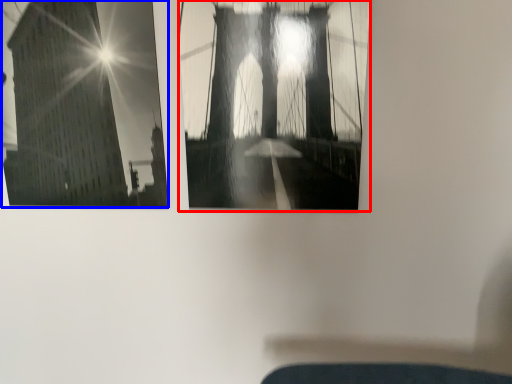
Question: Which point is closer to the camera, window (highlighted by a red box) or window (highlighted by a blue box)?

Choices:
 (A) window
 (B) window

Answer: (A)